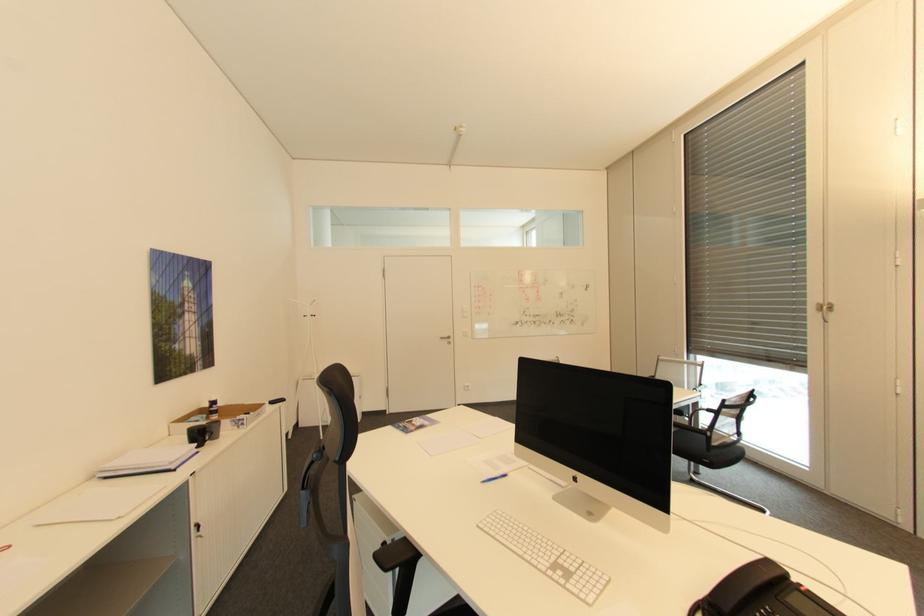
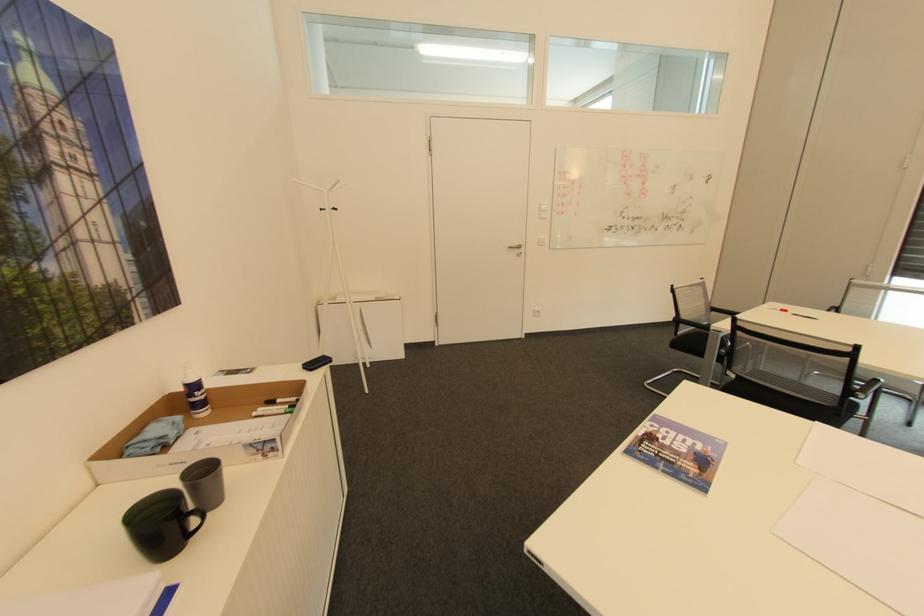
Locate, in the second image, the point that corresponds to the point at 209,438 in the first image.

(188, 531)